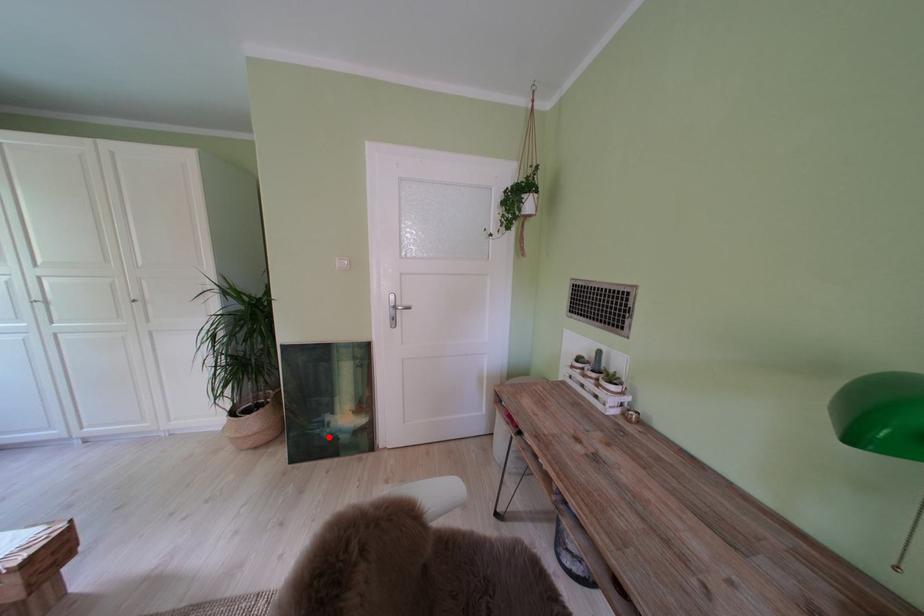
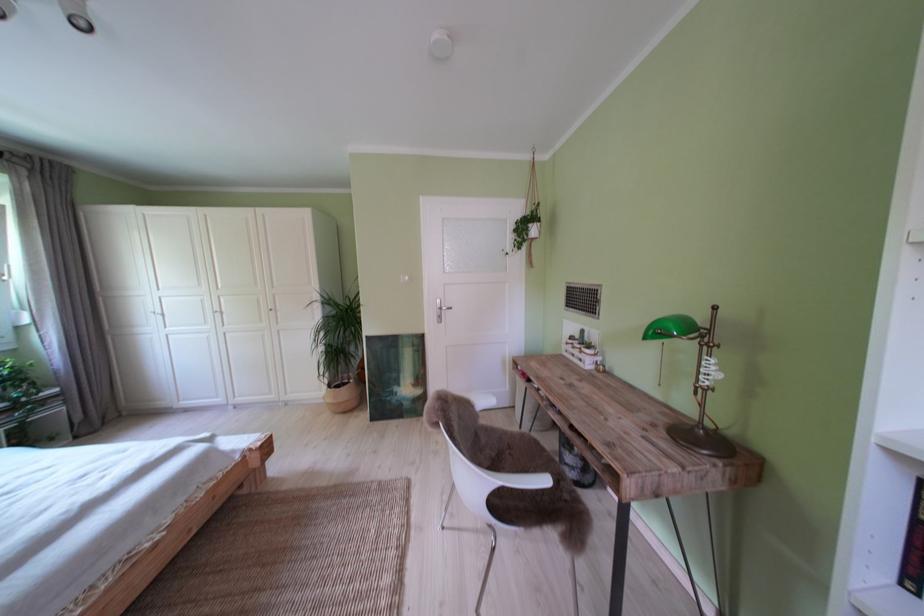
Question: I am providing you with two images of the same scene from different viewpoints. A red point is shown in image1. For the corresponding object point in image2, is it positioned nearer or farther from the camera?

Choices:
 (A) Nearer
 (B) Farther

Answer: (B)